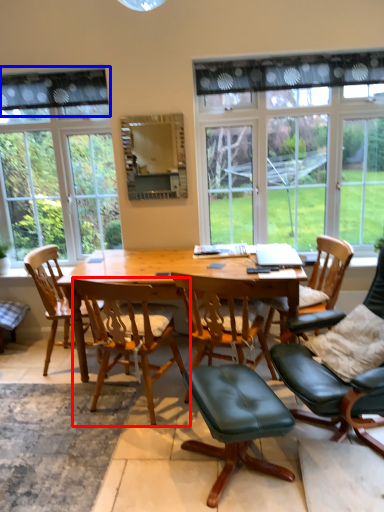
Question: Which object appears farthest to the camera in this image, chair (highlighted by a red box) or curtain (highlighted by a blue box)?

Choices:
 (A) chair
 (B) curtain

Answer: (B)